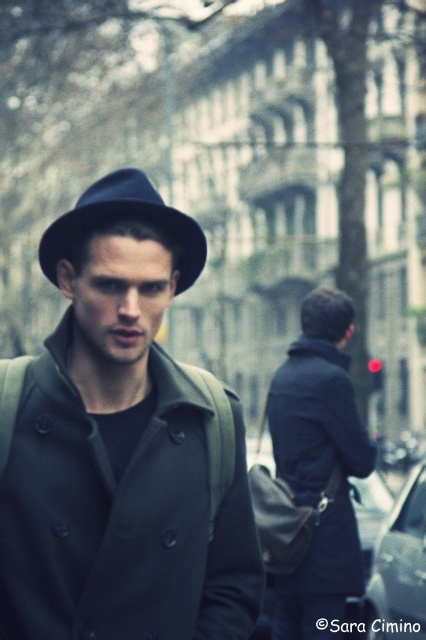
Consider the image. Can you confirm if matte black coat at center is positioned to the right of matte black fedora at center?

Yes, matte black coat at center is to the right of matte black fedora at center.

Is matte black coat at center further to the viewer compared to matte black fedora at center?

That is False.

Which is in front, point (91, 609) or point (89, 196)?

Positioned in front is point (91, 609).

Where is `matte black coat at center`? matte black coat at center is located at coordinates (121, 445).

Does dark blue leather jacket at center appear on the left side of matte black fedora at center?

No, dark blue leather jacket at center is not to the left of matte black fedora at center.

Does dark blue leather jacket at center have a lesser width compared to matte black fedora at center?

Correct, dark blue leather jacket at center's width is less than matte black fedora at center's.

Which is behind, point (319, 576) or point (69, 230)?

Positioned behind is point (319, 576).

Locate an element on the screen. This screenshot has height=640, width=426. dark blue leather jacket at center is located at coordinates (317, 467).

Consider the image. Between matte black coat at center and dark blue leather jacket at center, which one appears on the right side from the viewer's perspective?

dark blue leather jacket at center is more to the right.

Locate an element on the screen. matte black coat at center is located at coordinates (121, 445).